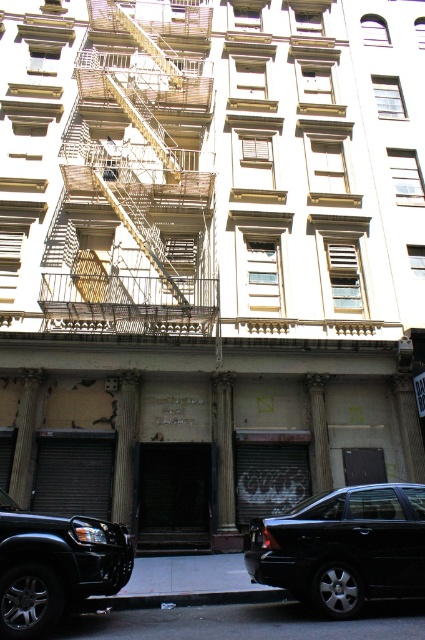
Which of these two, yellow metal fire escape at left or shiny black sedan at center, stands shorter?

shiny black sedan at center is shorter.

Is yellow metal fire escape at left smaller than shiny black sedan at center?

Incorrect, yellow metal fire escape at left is not smaller in size than shiny black sedan at center.

Who is more forward, (x=156, y=134) or (x=399, y=488)?

Point (x=399, y=488) is more forward.

Find the location of a particular element. The image size is (425, 640). yellow metal fire escape at left is located at coordinates 135,177.

Is yellow metal fire escape at left further to camera compared to black matte suv at lower left?

Yes, it is.

Between yellow metal fire escape at left and black matte suv at lower left, which one has more height?

yellow metal fire escape at left

Is point (147, 118) closer to camera compared to point (85, 554)?

That is False.

Where is `yellow metal fire escape at left`? yellow metal fire escape at left is located at coordinates (135, 177).

Is shiny black sedan at center to the right of black matte suv at lower left from the viewer's perspective?

Correct, you'll find shiny black sedan at center to the right of black matte suv at lower left.

You are a GUI agent. You are given a task and a screenshot of the screen. Output one action in this format:
    pyautogui.click(x=<x>, y=<y>)
    Task: Click on the shiny black sedan at center
    The image size is (425, 640).
    Given the screenshot: What is the action you would take?
    pyautogui.click(x=343, y=547)

Consider the image. Measure the distance between point [334,520] and camera.

The distance of point [334,520] from camera is 6.35 meters.

At what (x,y) coordinates should I click in order to perform the action: click on shiny black sedan at center. Please return your answer as a coordinate pair (x, y). The height and width of the screenshot is (640, 425). Looking at the image, I should click on (343, 547).